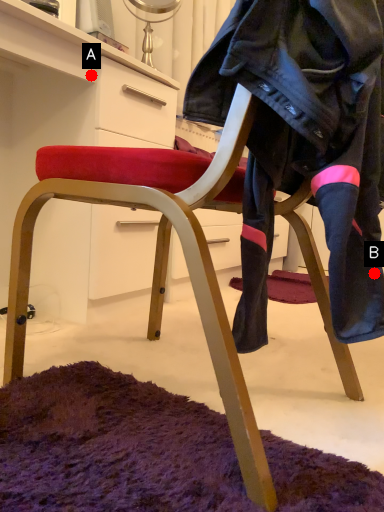
Question: Two points are circled on the image, labeled by A and B beside each circle. Which point is closer to the camera?

Choices:
 (A) A is closer
 (B) B is closer

Answer: (B)